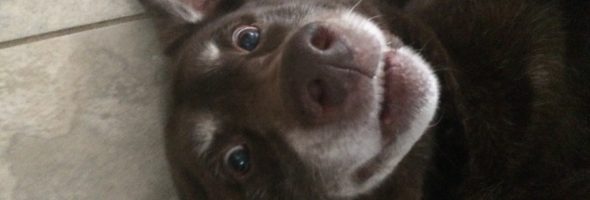
Find the location of a particular element. The height and width of the screenshot is (200, 590). floor tiles is located at coordinates (303, 165), (59, 178).